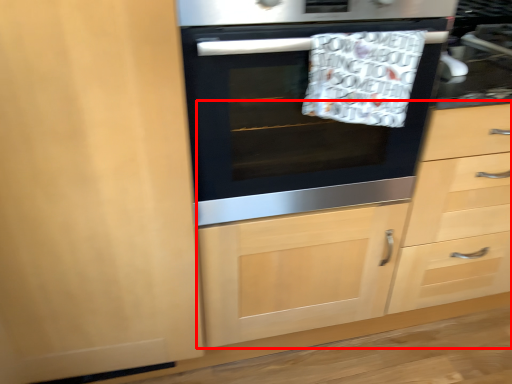
Question: In this image, where is dresser (annotated by the red box) located relative to oven?

Choices:
 (A) left
 (B) right

Answer: (B)